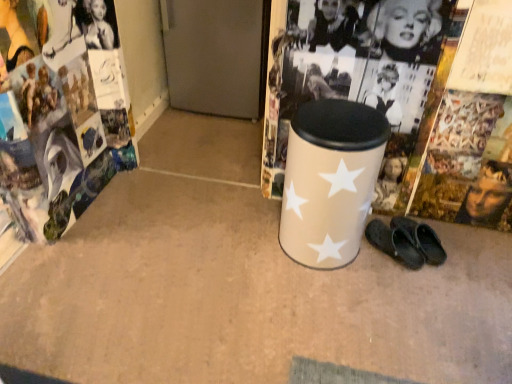
Question: From the image's perspective, does beige matte waste container at center appear higher than matte paper magazine at left?

Choices:
 (A) no
 (B) yes

Answer: (A)

Question: Is matte paper magazine at left inside beige matte waste container at center?

Choices:
 (A) no
 (B) yes

Answer: (A)

Question: Is the surface of beige matte waste container at center in direct contact with matte paper magazine at left?

Choices:
 (A) no
 (B) yes

Answer: (A)

Question: From a real-world perspective, is beige matte waste container at center physically above matte paper magazine at left?

Choices:
 (A) no
 (B) yes

Answer: (B)

Question: Does beige matte waste container at center have a smaller size compared to matte paper magazine at left?

Choices:
 (A) no
 (B) yes

Answer: (A)

Question: In the image, is black rubber slippers at lower right positioned in front of or behind beige matte waste container at center?

Choices:
 (A) behind
 (B) front

Answer: (A)

Question: From their relative heights in the image, would you say black rubber slippers at lower right is taller or shorter than beige matte waste container at center?

Choices:
 (A) short
 (B) tall

Answer: (A)

Question: In terms of width, does black rubber slippers at lower right look wider or thinner when compared to beige matte waste container at center?

Choices:
 (A) thin
 (B) wide

Answer: (A)

Question: From a real-world perspective, is black rubber slippers at lower right above or below beige matte waste container at center?

Choices:
 (A) below
 (B) above

Answer: (A)

Question: From a real-world perspective, relative to matte paper magazine at left, is black rubber slippers at lower right vertically above or below?

Choices:
 (A) below
 (B) above

Answer: (B)

Question: Is black rubber slippers at lower right spatially inside matte paper magazine at left, or outside of it?

Choices:
 (A) inside
 (B) outside

Answer: (B)

Question: From the image's perspective, relative to matte paper magazine at left, is black rubber slippers at lower right above or below?

Choices:
 (A) above
 (B) below

Answer: (B)

Question: Considering the positions of black rubber slippers at lower right and matte paper magazine at left in the image, is black rubber slippers at lower right wider or thinner than matte paper magazine at left?

Choices:
 (A) wide
 (B) thin

Answer: (B)

Question: Is point (291, 249) positioned closer to the camera than point (380, 249)?

Choices:
 (A) farther
 (B) closer

Answer: (B)

Question: Considering the positions of beige matte waste container at center and black rubber slippers at lower right in the image, is beige matte waste container at center taller or shorter than black rubber slippers at lower right?

Choices:
 (A) tall
 (B) short

Answer: (A)